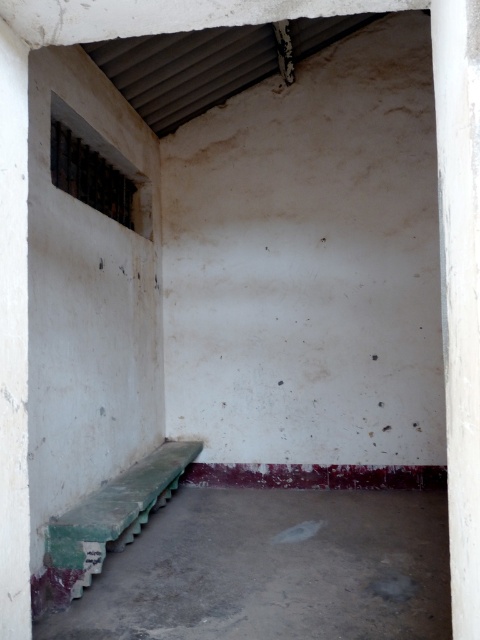
Question: Is green painted concrete bench at lower left closer to the viewer compared to green painted wood bench at lower left?

Choices:
 (A) yes
 (B) no

Answer: (A)

Question: In this image, where is white smooth pillar at right located relative to green painted wood bench at lower left?

Choices:
 (A) right
 (B) left

Answer: (A)

Question: Does white smooth pillar at right have a larger size compared to green painted wood bench at lower left?

Choices:
 (A) yes
 (B) no

Answer: (B)

Question: Which object is positioned closest to the green painted wood bench at lower left?

Choices:
 (A) white smooth pillar at right
 (B) green painted concrete bench at lower left
 (C) white concrete pillar at left

Answer: (B)

Question: Which point appears closest to the camera in this image?

Choices:
 (A) (x=48, y=538)
 (B) (x=289, y=602)
 (C) (x=9, y=356)

Answer: (C)

Question: Which object is positioned closest to the green painted wood bench at lower left?

Choices:
 (A) white smooth pillar at right
 (B) white concrete pillar at left
 (C) green painted concrete bench at lower left

Answer: (C)